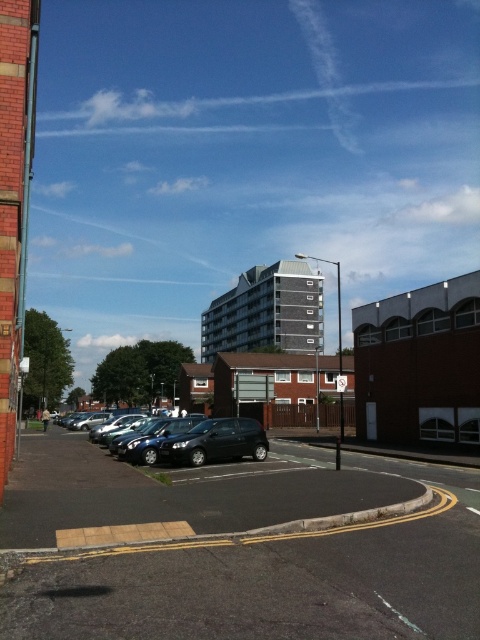
Can you confirm if black asphalt parking lot at center is positioned above shiny black car at center?

Yes, black asphalt parking lot at center is above shiny black car at center.

Which is more to the right, black asphalt parking lot at center or shiny black car at center?

From the viewer's perspective, black asphalt parking lot at center appears more on the right side.

Does point (394, 493) come farther from viewer compared to point (187, 454)?

That is False.

The width and height of the screenshot is (480, 640). Find the location of `black asphalt parking lot at center`. black asphalt parking lot at center is located at coordinates (241, 548).